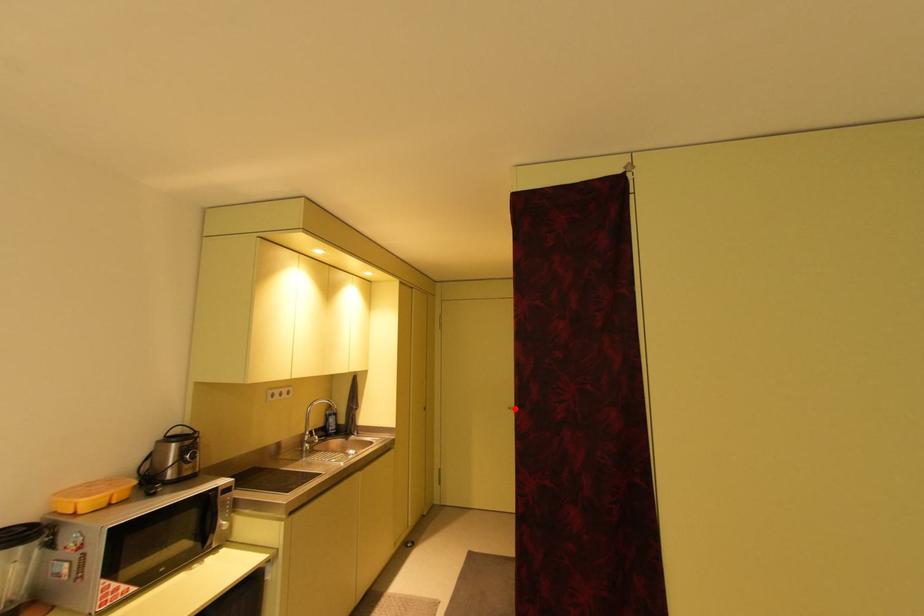
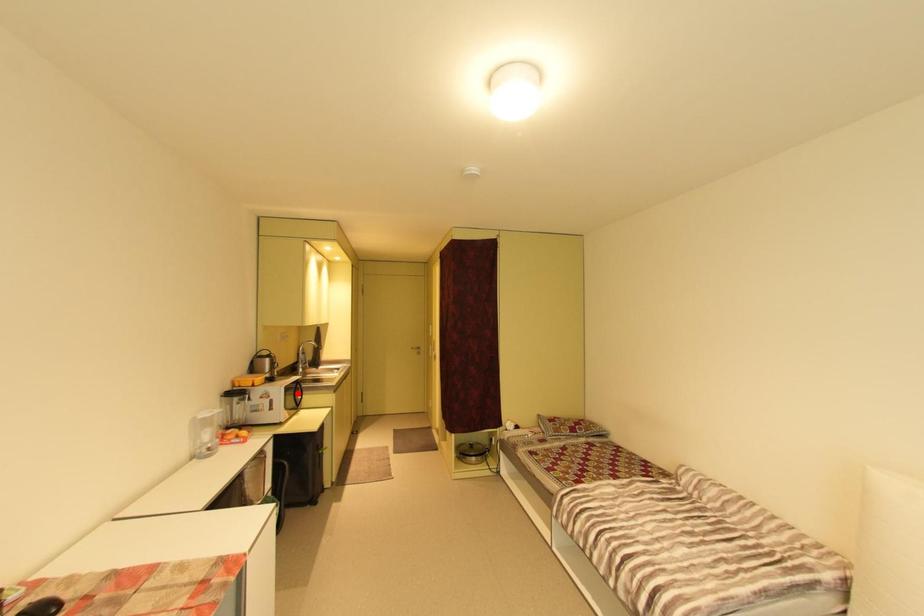
I am providing you with two images of the same scene from different viewpoints. A red point is marked on the first image and another point is marked on the second image. Does the point marked in image1 correspond to the same location as the one in image2?

No